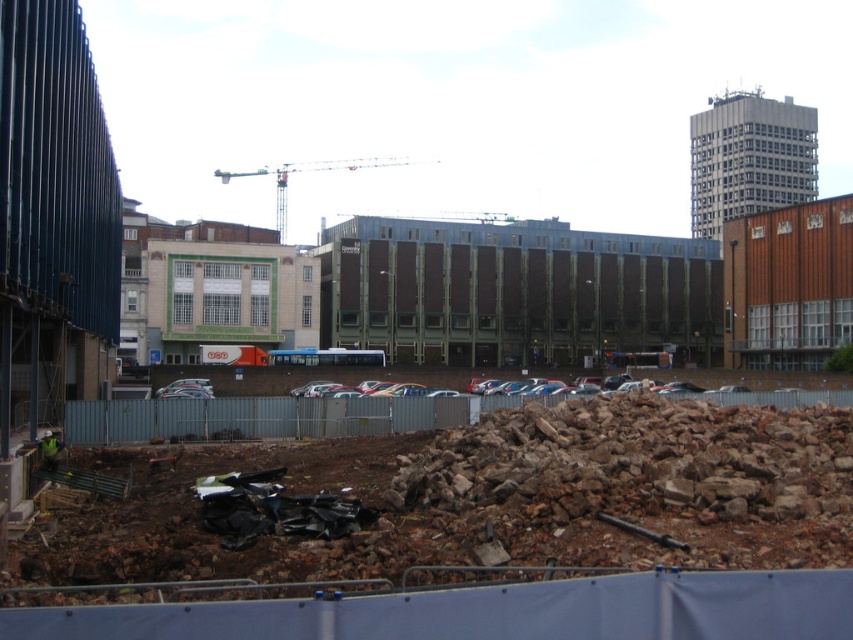
You are a construction worker wearing a reflective yellow vest at lower left and need to reach the metallic gray crane at upper center to operate it. Which direction should you move to get closer to the crane?

You should move forward towards the metallic gray crane at upper center since it is closer to you than the reflective yellow vest at lower left, which is behind you.

You are a construction worker who needs to place a safety cone between the rusty concrete rubble at lower center and the reflective yellow vest at lower left. Considering their heights, which object should the cone be placed closer to?

The rusty concrete rubble at lower center is taller than the reflective yellow vest at lower left. Therefore, the safety cone should be placed closer to the reflective yellow vest at lower left to ensure visibility over the shorter object.

You are a construction worker who needs to place a new safety sign that must be visible from both the parking lot and the temporary fence. The sign must be placed at a height that is taller than the rusty concrete rubble at lower center but shorter than the metallic gray crane at upper center. Is this possible?

Yes, it is possible to place the safety sign at a height between the rusty concrete rubble at lower center and the metallic gray crane at upper center since the crane is taller than the rubble.